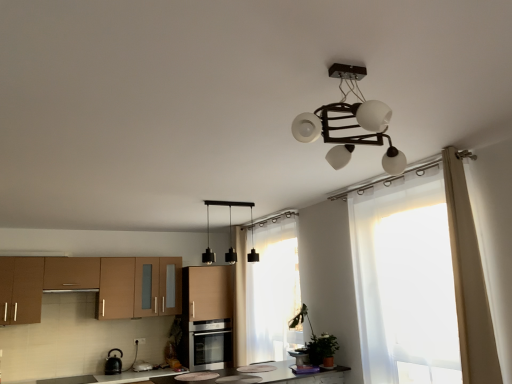
Question: From the image's perspective, would you say black matte pendant lights at center is shown under sheer white curtain at center, which is the second curtain from front to back?

Choices:
 (A) yes
 (B) no

Answer: (B)

Question: Is black matte pendant lights at center in contact with sheer white curtain at center, which is the second curtain from front to back?

Choices:
 (A) no
 (B) yes

Answer: (A)

Question: Can you confirm if black matte pendant lights at center is shorter than sheer white curtain at center, the second curtain from the right?

Choices:
 (A) no
 (B) yes

Answer: (B)

Question: From a real-world perspective, is black matte pendant lights at center located higher than sheer white curtain at center, which is the second curtain from front to back?

Choices:
 (A) yes
 (B) no

Answer: (A)

Question: Can you confirm if black matte pendant lights at center is thinner than sheer white curtain at center, which is the second curtain from front to back?

Choices:
 (A) no
 (B) yes

Answer: (A)

Question: Is point (112, 360) positioned closer to the camera than point (381, 190)?

Choices:
 (A) closer
 (B) farther

Answer: (B)

Question: Looking at the image, does black glossy kettle at lower left, the 1th appliance when ordered from back to front, seem bigger or smaller compared to translucent white curtain at right?

Choices:
 (A) big
 (B) small

Answer: (B)

Question: Is black glossy kettle at lower left, marked as the first appliance in a bottom-to-top arrangement, wider or thinner than translucent white curtain at right?

Choices:
 (A) wide
 (B) thin

Answer: (A)

Question: Is black glossy kettle at lower left, which is counted as the second appliance, starting from the top, spatially inside translucent white curtain at right, or outside of it?

Choices:
 (A) inside
 (B) outside

Answer: (B)

Question: Considering the relative positions of brown matte cabinet at left, the second cabinetry when ordered from right to left, and satin silver oven at center in the image provided, is brown matte cabinet at left, the second cabinetry when ordered from right to left, to the left or to the right of satin silver oven at center?

Choices:
 (A) left
 (B) right

Answer: (A)

Question: In terms of height, does brown matte cabinet at left, the second cabinetry when ordered from right to left, look taller or shorter compared to satin silver oven at center?

Choices:
 (A) tall
 (B) short

Answer: (A)

Question: From the image's perspective, relative to satin silver oven at center, is brown matte cabinet at left, which appears as the 1th cabinetry when viewed from the left, above or below?

Choices:
 (A) below
 (B) above

Answer: (B)

Question: Considering their positions, is brown matte cabinet at left, the second cabinetry when ordered from right to left, located in front of or behind satin silver oven at center?

Choices:
 (A) front
 (B) behind

Answer: (A)

Question: From the image's perspective, relative to brown matte cabinet at left, the second cabinetry when ordered from right to left, is satin silver oven at center above or below?

Choices:
 (A) above
 (B) below

Answer: (B)

Question: Considering their positions, is satin silver oven at center located in front of or behind brown matte cabinet at left, which appears as the 1th cabinetry when viewed from the left?

Choices:
 (A) front
 (B) behind

Answer: (B)